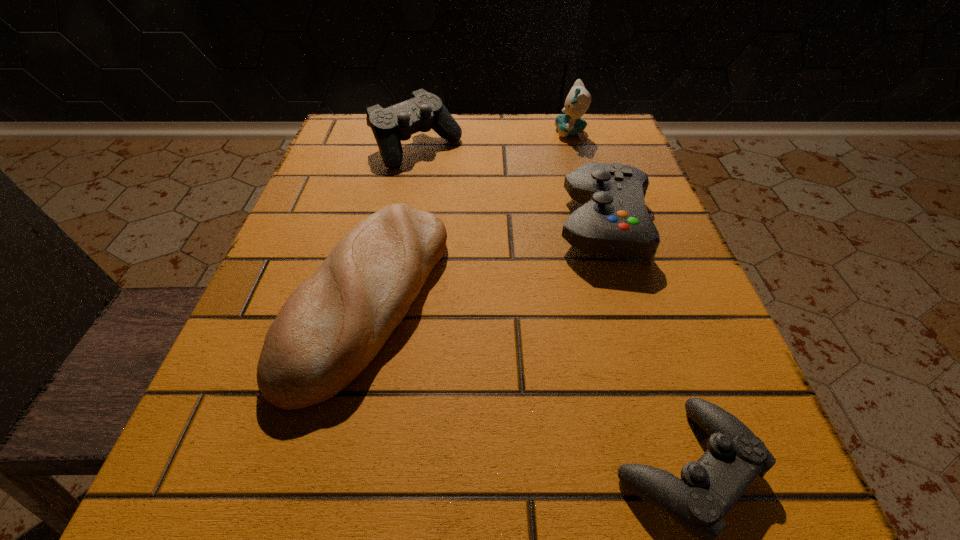
Where is `the tallest object`? This screenshot has height=540, width=960. the tallest object is located at coordinates (578, 100).

Where is `the farthest control`? the farthest control is located at coordinates (424, 111).

This screenshot has width=960, height=540. In order to click on the second farthest control in this screenshot , I will do `click(613, 220)`.

Find the location of a particular element. bread is located at coordinates (330, 328).

Image resolution: width=960 pixels, height=540 pixels. Find the location of `blank space located on the face of the tallest object`. blank space located on the face of the tallest object is located at coordinates (413, 133).

At what (x,y) coordinates should I click in order to perform the action: click on vacant point located 0.230m on the face of the tallest object. Please return your answer as a coordinate pair (x, y). The image size is (960, 540). Looking at the image, I should click on (453, 133).

Find the location of `free spot located 0.080m on the face of the tallest object`. free spot located 0.080m on the face of the tallest object is located at coordinates (519, 133).

Where is `blank space located on the front of the farthest control`? This screenshot has height=540, width=960. blank space located on the front of the farthest control is located at coordinates (406, 199).

Locate an element on the screen. Image resolution: width=960 pixels, height=540 pixels. vacant area located 0.240m on the back of the second farthest control is located at coordinates (574, 128).

Find the location of `free location located 0.140m on the back of the bread`. free location located 0.140m on the back of the bread is located at coordinates point(397,177).